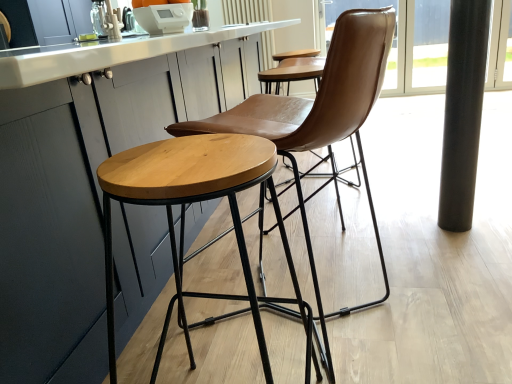
Locate an element on the screen. free space that is in between brown leather chair at center and black polished pole at right is located at coordinates (403, 258).